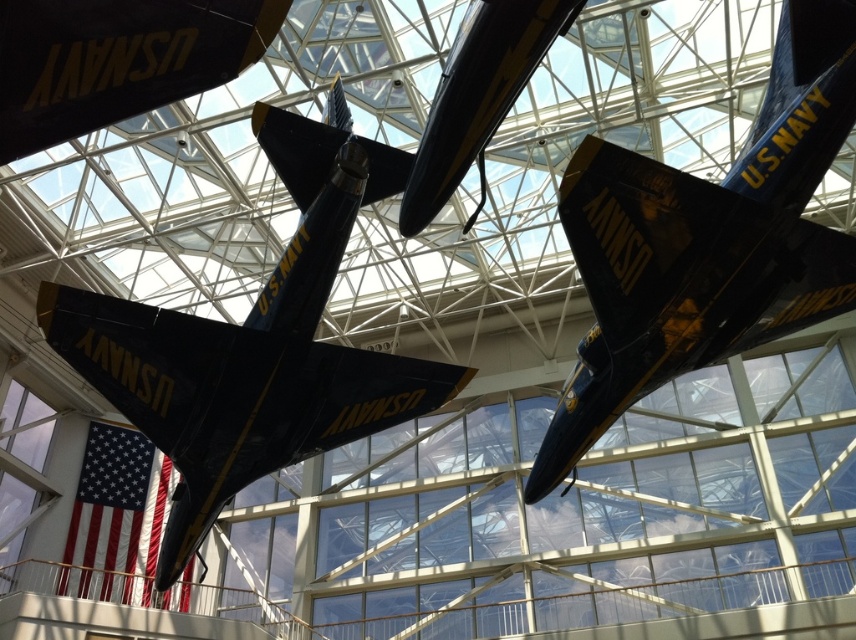
You are standing in the museum and want to take a photo of the glossy black airplane at upper center. The museum has a rule that visitors must stay at least 1 meter away from the railing for safety. If the railing is located at point 0.5, can you safely take the photo from your current position at point 0.378?

The glossy black airplane at upper center is located at point 0.378, which is within the required 1 meter safety distance from the railing at point 0.5. Therefore, you can safely take the photo from your current position.

You are a visitor at the museum and want to take a photo of both the glossy black airplane at upper center and the shiny black airplane at center. Which airplane should you focus on first to ensure both are in the frame?

You should focus on the shiny black airplane at center first because it is taller than the glossy black airplane at upper center, so it will be easier to include both in the frame by centering the taller one.